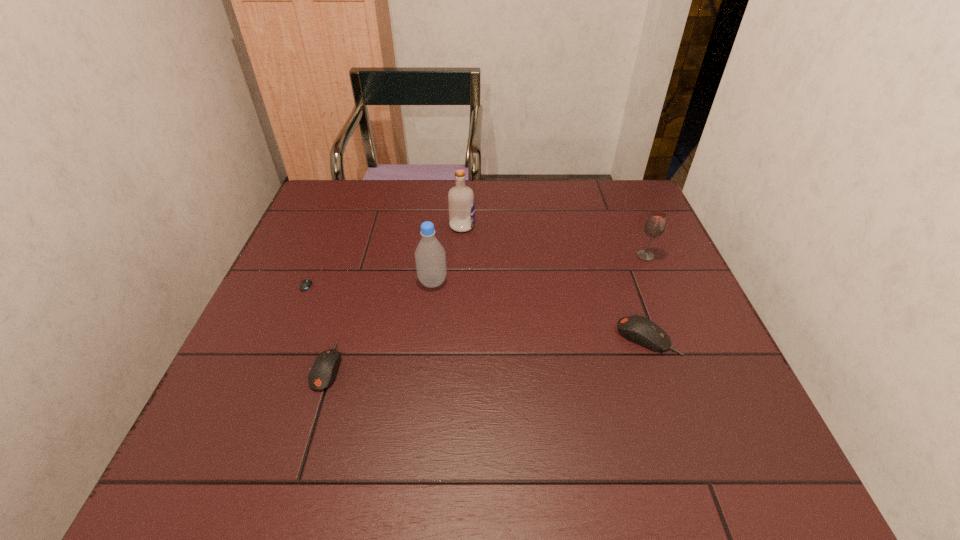
Locate an element on the screen. Image resolution: width=960 pixels, height=540 pixels. mouse that stands as the second closest to the second tallest mouse is located at coordinates (638, 329).

I want to click on free region that satisfies the following two spatial constraints: 1. on the back side of the tallest mouse; 2. on the label of the farthest object, so click(608, 226).

Where is `free space that satisfies the following two spatial constraints: 1. on the back side of the shortest object; 2. on the right side of the third tallest object`? This screenshot has height=540, width=960. free space that satisfies the following two spatial constraints: 1. on the back side of the shortest object; 2. on the right side of the third tallest object is located at coordinates (321, 256).

I want to click on vacant space that satisfies the following two spatial constraints: 1. on the label of the farthest object; 2. on the left side of the tallest mouse, so click(457, 337).

Identify the location of vacant space that satisfies the following two spatial constraints: 1. on the label of the farthest object; 2. on the front side of the second shortest mouse. (455, 366).